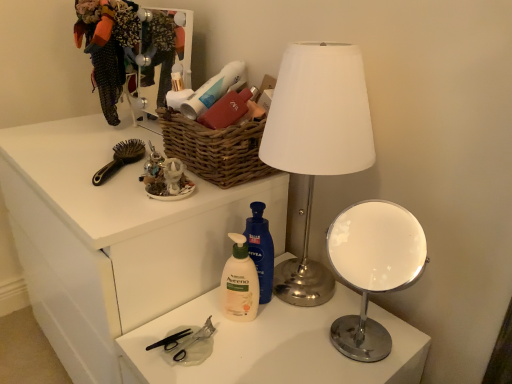
Locate an element on the screen. vacant area that lies between metallic silver mirror at upper center and patterned fabric dress at upper left is located at coordinates (139, 132).